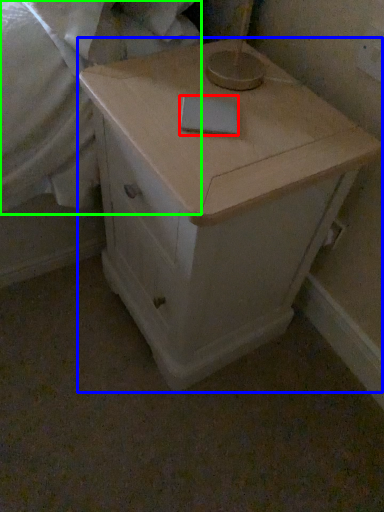
Question: Which object is the closest to the notepad (highlighted by a red box)? Choose among these: chest of drawers (highlighted by a blue box) or sheet (highlighted by a green box).

Choices:
 (A) chest of drawers
 (B) sheet

Answer: (A)